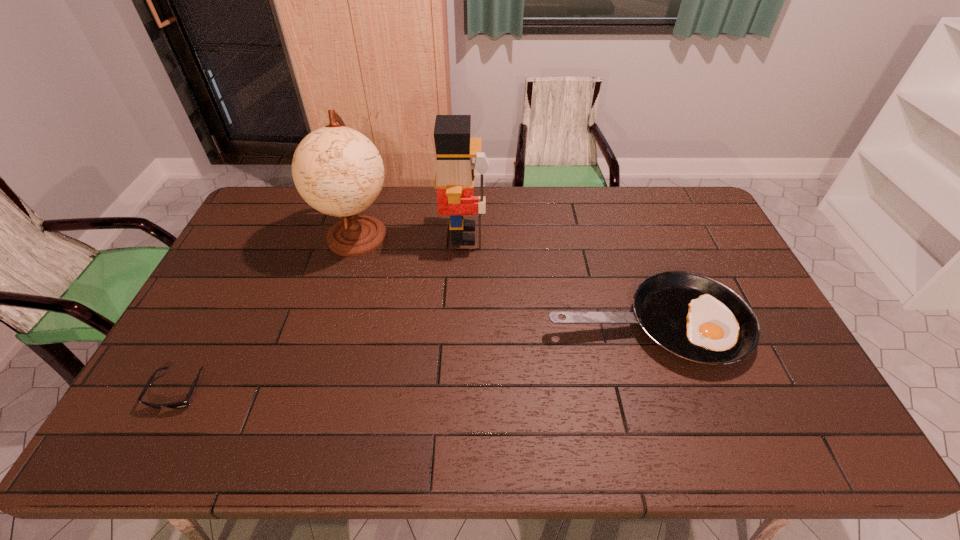
You are a GUI agent. You are given a task and a screenshot of the screen. Output one action in this format:
    pyautogui.click(x=<x>, y=<y>)
    Task: Click on the free spot that satisfies the following two spatial constraints: 1. on the back side of the frying pan; 2. in front of the nutcracker holding the staff
    The height and width of the screenshot is (540, 960).
    Given the screenshot: What is the action you would take?
    pyautogui.click(x=616, y=235)

Find the location of a particular element. vacant space that satisfies the following two spatial constraints: 1. in front of the third object from left to right holding the staff; 2. on the left side of the third tallest object is located at coordinates (460, 325).

The width and height of the screenshot is (960, 540). What are the coordinates of `free space that satisfies the following two spatial constraints: 1. in front of the nutcracker holding the staff; 2. on the surface of the second object from left to right` in the screenshot? It's located at (464, 236).

This screenshot has height=540, width=960. Find the location of `free space that satisfies the following two spatial constraints: 1. in front of the nutcracker holding the staff; 2. on the surface of the globe`. free space that satisfies the following two spatial constraints: 1. in front of the nutcracker holding the staff; 2. on the surface of the globe is located at coordinates (464, 236).

This screenshot has width=960, height=540. Find the location of `vacant space that satisfies the following two spatial constraints: 1. in front of the third object from left to right holding the staff; 2. on the right side of the rightmost object`. vacant space that satisfies the following two spatial constraints: 1. in front of the third object from left to right holding the staff; 2. on the right side of the rightmost object is located at coordinates (460, 325).

The height and width of the screenshot is (540, 960). I want to click on free point that satisfies the following two spatial constraints: 1. in front of the nutcracker holding the staff; 2. on the front-facing side of the leftmost object, so click(458, 391).

Locate an element on the screen. The width and height of the screenshot is (960, 540). free space that satisfies the following two spatial constraints: 1. in front of the nutcracker holding the staff; 2. on the front-facing side of the leftmost object is located at coordinates (458, 391).

In order to click on vacant space that satisfies the following two spatial constraints: 1. in front of the nutcracker holding the staff; 2. on the back side of the frying pan in this screenshot , I will do `click(460, 325)`.